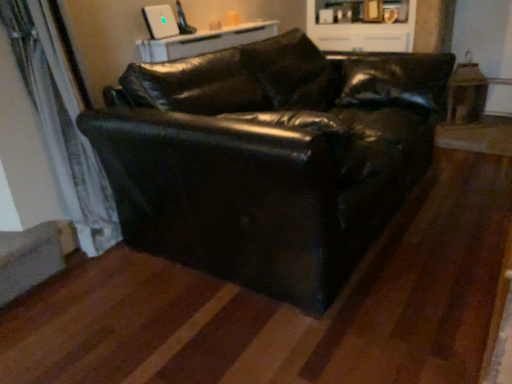
I want to click on vacant space underneath white sheer curtain at left (from a real-world perspective), so click(81, 267).